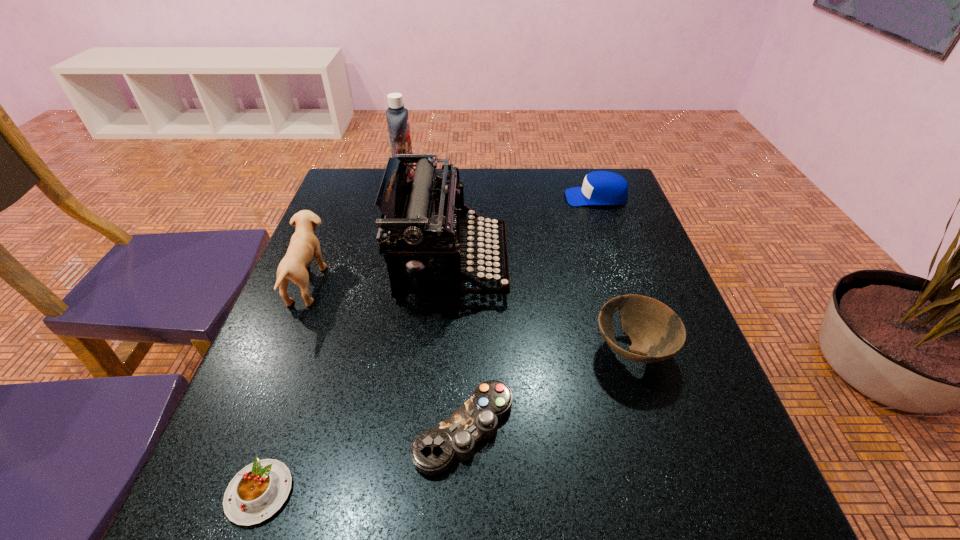
In the image, there is a desktop. Identify the location of vacant space at the far right corner. (607, 212).

This screenshot has width=960, height=540. In order to click on vacant area between the bowl and the control in this screenshot , I will do `click(548, 389)`.

Where is `free space between the sixth nearest object and the typewriter`? This screenshot has width=960, height=540. free space between the sixth nearest object and the typewriter is located at coordinates (524, 231).

Locate an element on the screen. This screenshot has height=540, width=960. free spot between the control and the bowl is located at coordinates (548, 389).

You are a GUI agent. You are given a task and a screenshot of the screen. Output one action in this format:
    pyautogui.click(x=<x>, y=<y>)
    Task: Click on the vacant area that lies between the bowl and the third tallest object
    The image size is (960, 540).
    Given the screenshot: What is the action you would take?
    pyautogui.click(x=470, y=317)

The height and width of the screenshot is (540, 960). What are the coordinates of `unoccupied area between the control and the farthest object` in the screenshot? It's located at (435, 303).

Where is `unoccupied area between the control and the farthest object`? This screenshot has width=960, height=540. unoccupied area between the control and the farthest object is located at coordinates (435, 303).

Find the location of `free space between the bowl and the typewriter`. free space between the bowl and the typewriter is located at coordinates (542, 308).

The image size is (960, 540). In order to click on unoccupied position between the control and the typewriter in this screenshot , I will do `click(458, 347)`.

This screenshot has width=960, height=540. What are the coordinates of `free space that is in between the control and the typewriter` in the screenshot? It's located at (458, 347).